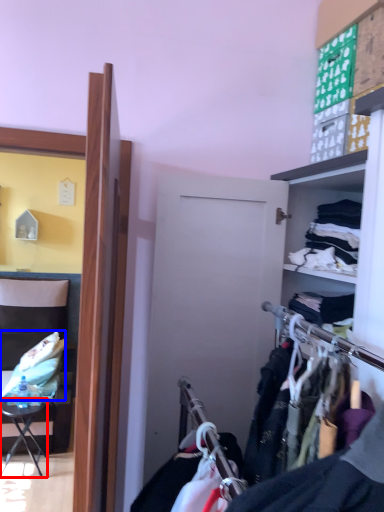
Question: Which of the following is the closest to the observer, table (highlighted by a red box) or clothing (highlighted by a blue box)?

Choices:
 (A) table
 (B) clothing

Answer: (A)